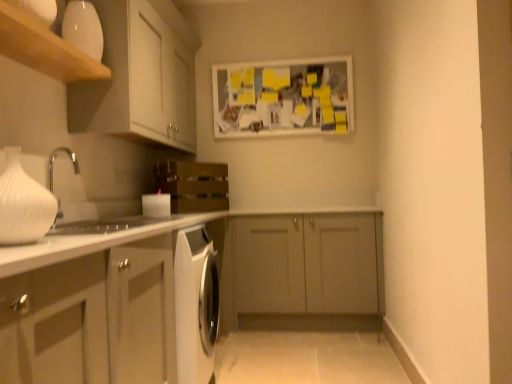
Question: From a real-world perspective, relative to matte gray cabinet at center, which ranks as the second cabinetry in bottom-to-top order, is white matte bulletin board at upper center vertically above or below?

Choices:
 (A) above
 (B) below

Answer: (A)

Question: From their relative heights in the image, would you say white matte bulletin board at upper center is taller or shorter than matte gray cabinet at center, acting as the 2th cabinetry starting from the top?

Choices:
 (A) tall
 (B) short

Answer: (B)

Question: Which object is the farthest from the white matte vase at left?

Choices:
 (A) wooden crate at center
 (B) white matte cabinet at lower left, marked as the first cabinetry in a bottom-to-top arrangement
 (C) white matte bulletin board at upper center
 (D) white matte cabinet at upper left, positioned as the first cabinetry in top-to-bottom order
 (E) wooden shelf at upper left

Answer: (C)

Question: Estimate the real-world distances between objects in this image. Which object is closer to the white matte cabinet at upper left, positioned as the first cabinetry in top-to-bottom order?

Choices:
 (A) wooden shelf at upper left
 (B) wooden crate at center
 (C) white matte bulletin board at upper center
 (D) white glossy sink at left
 (E) white matte vase at left

Answer: (B)